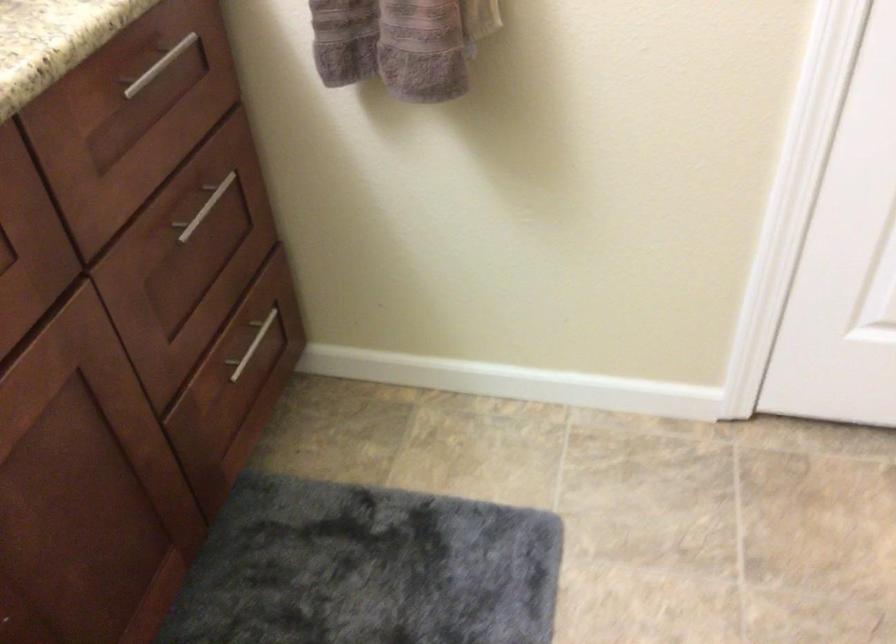
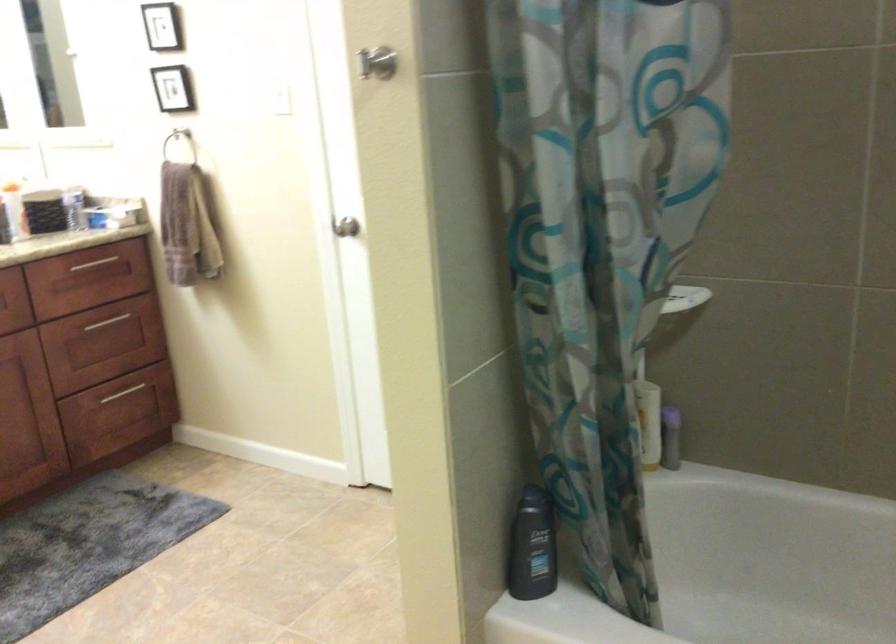
Which direction would the cameraman need to move to produce the second image?

The cameraman moved toward right, backward.